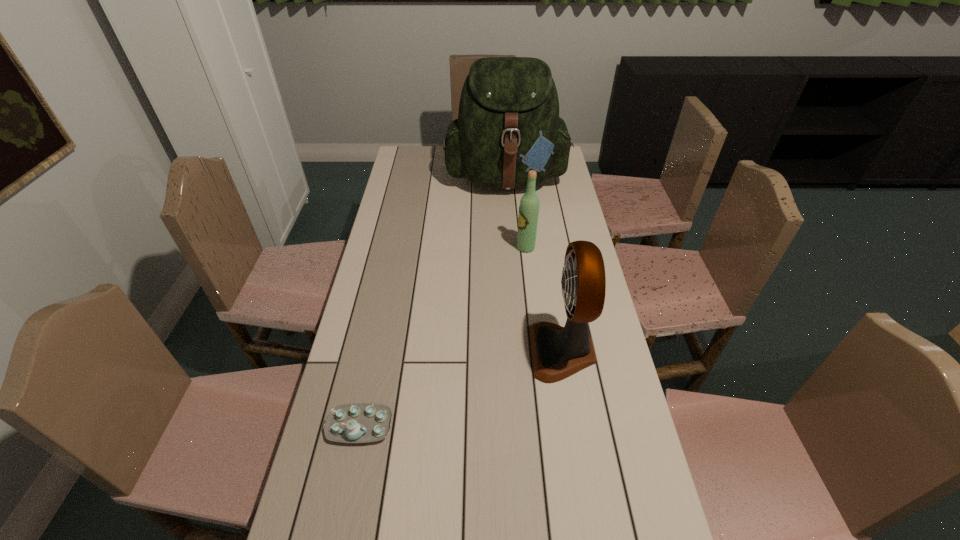
What are the coordinates of `the tallest object` in the screenshot? It's located at (508, 123).

Find the location of `the farthest object`. the farthest object is located at coordinates (508, 123).

Identify the location of fan. This screenshot has height=540, width=960. (557, 352).

Where is `the second nearest object`? Image resolution: width=960 pixels, height=540 pixels. the second nearest object is located at coordinates (557, 352).

Where is `the second farthest object`? the second farthest object is located at coordinates (529, 205).

Identify the location of the second shortest object. This screenshot has height=540, width=960. (529, 205).

The width and height of the screenshot is (960, 540). Identify the location of the nearest object. (358, 422).

At what (x,y) coordinates should I click in order to perform the action: click on the shortest object. Please return your answer as a coordinate pair (x, y). Looking at the image, I should click on (358, 422).

You are a GUI agent. You are given a task and a screenshot of the screen. Output one action in this format:
    pyautogui.click(x=<x>, y=<y>)
    Task: Click on the free spot located on the open flap of the tallest object
    The height and width of the screenshot is (540, 960).
    Given the screenshot: What is the action you would take?
    tap(515, 273)

Where is `blank space located on the front-facing side of the second nearest object`? blank space located on the front-facing side of the second nearest object is located at coordinates (420, 351).